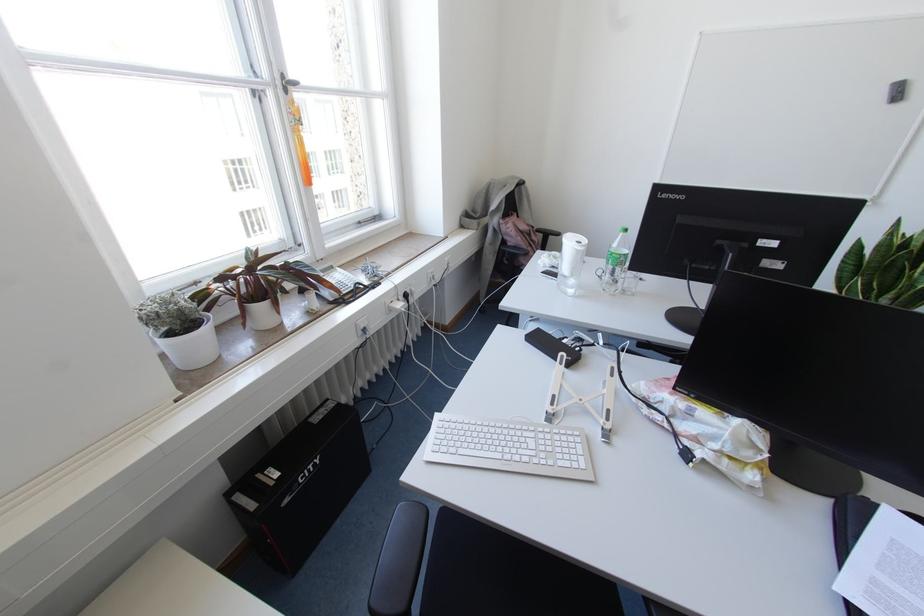
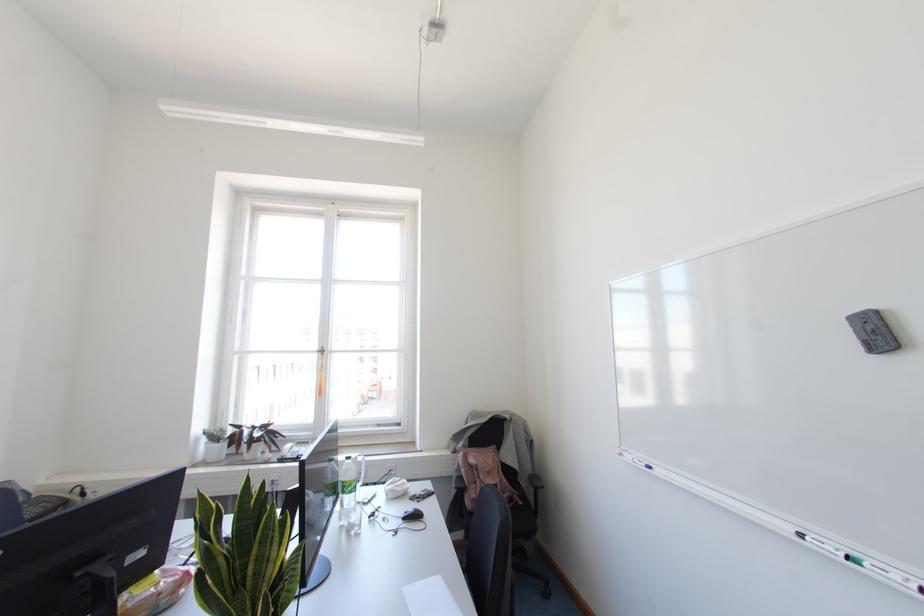
In the second image, find the point that corresponds to pixel 186 298 in the first image.

(223, 431)